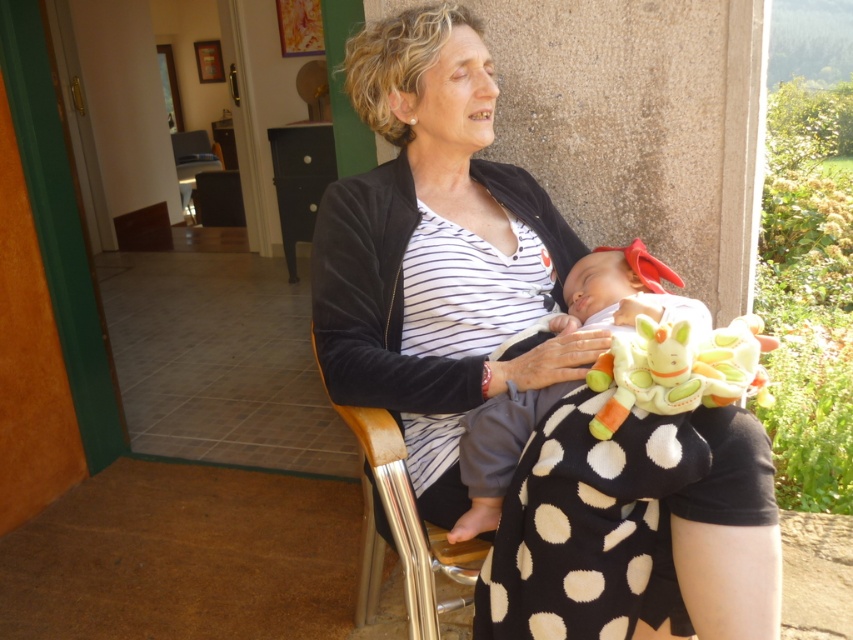
You are a delivery robot that is 0.8 meters wide. You need to move from the open doorway to the older woman seated on the chair. The path is blocked by the tiled floor. The point at (x=627, y=257) is on the tiled floor. The older woman is seated at another point. How far apart are these two points?

The two points are 1.30 meters apart.

You are a delivery person carrying a package that requires placing it on either the metallic silver chair at center or the matte black chair at center. The package requires a chair that is at least 20 feet away from another chair. Which chair should you choose?

The metallic silver chair at center is 18.91 feet away from the matte black chair at center, so neither chair meets the requirement of being at least 20 feet apart. Therefore, you cannot place the package on either chair as they are too close to each other.

You are a photographer trying to capture the striped fabric shirt at center and the matte black chair at center in a single shot. Since you want to focus on the shirt, where should you position the camera relative to the chair?

The striped fabric shirt at center is in front of the matte black chair at center, so position the camera closer to the striped fabric shirt at center to ensure it is in focus while the chair remains in the background.